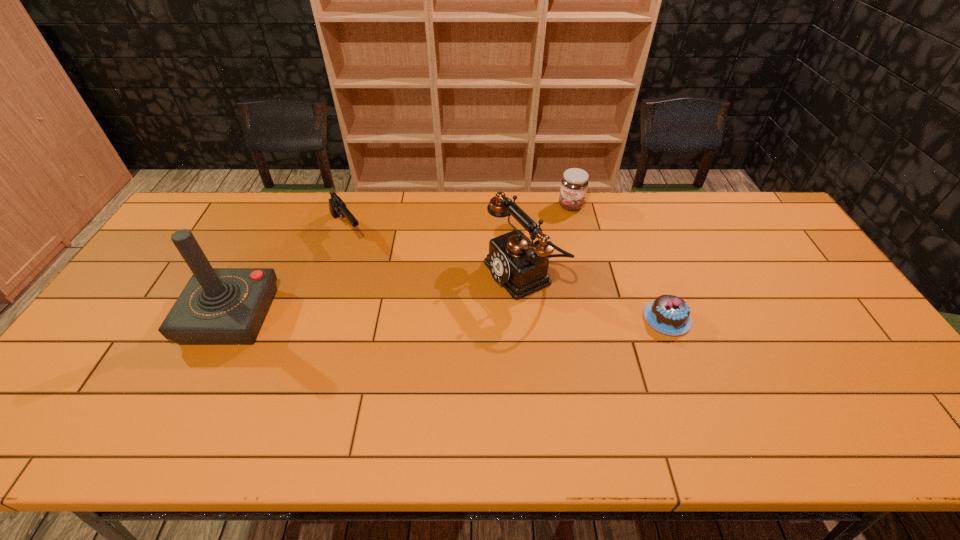
Locate an element on the screen. The height and width of the screenshot is (540, 960). free space on the desktop that is between the tallest object and the rightmost object and is positioned on the front of the third object from right to left at the rotary dial is located at coordinates (421, 317).

I want to click on free spot on the desktop that is between the tallest object and the chocolate cake and is positioned at the end of the barrel of the second object from left to right, so click(x=414, y=317).

You are a GUI agent. You are given a task and a screenshot of the screen. Output one action in this format:
    pyautogui.click(x=<x>, y=<y>)
    Task: Click on the free space on the desktop that is between the tallest object and the rightmost object and is positioned on the front label of the fourth object from left to right
    The image size is (960, 540).
    Given the screenshot: What is the action you would take?
    pyautogui.click(x=509, y=318)